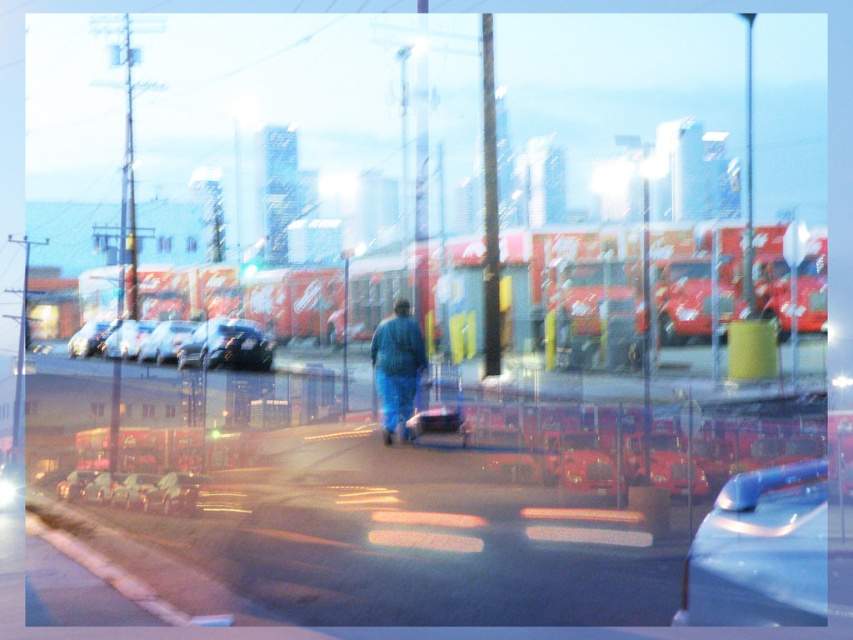
Question: Estimate the real-world distances between objects in this image. Which object is farther from the shiny black car at center?

Choices:
 (A) metallic blue car at center
 (B) metallic silver car at center

Answer: (A)

Question: Where is shiny silver car at center located in relation to metallic silver car at center in the image?

Choices:
 (A) below
 (B) above

Answer: (A)

Question: In this image, where is shiny silver car at center located relative to shiny silver sedan at left?

Choices:
 (A) left
 (B) right

Answer: (B)

Question: Is shiny silver sedan at left bigger than metallic silver car at center?

Choices:
 (A) yes
 (B) no

Answer: (B)

Question: Estimate the real-world distances between objects in this image. Which object is farther from the blue denim pants at center?

Choices:
 (A) shiny silver car at center
 (B) shiny black sedan at left

Answer: (A)

Question: Among these objects, which one is nearest to the camera?

Choices:
 (A) metallic blue car at center
 (B) metallic red truck at center

Answer: (A)